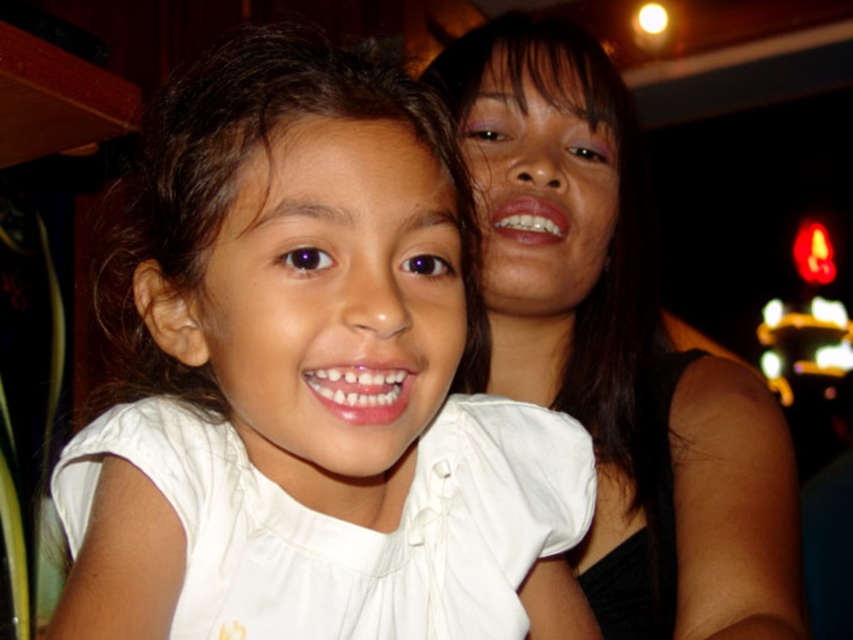
You are a photographer adjusting your camera. You notice the white matte shirt at center and the matte black hair at upper right. Which object is positioned nearer to you?

The white matte shirt at center is closer to the viewer than the matte black hair at upper right.

You are a photographer trying to adjust the lighting for a portrait. You notice the white matte shirt at center and the matte black hair at upper right. Which object is positioned to the left of the other?

The white matte shirt at center is to the left of matte black hair at upper right.